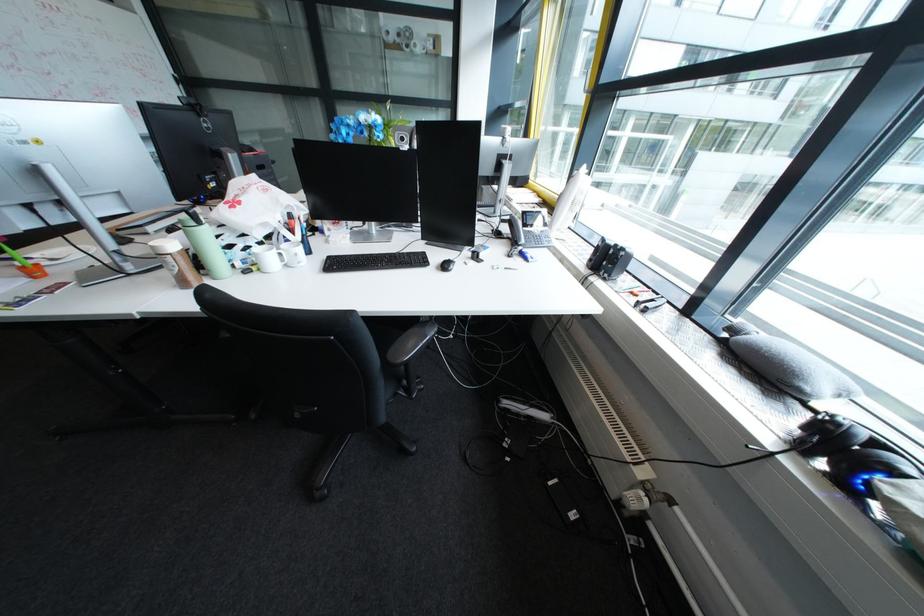
Where would you turn the radiator thermostat? Please return your answer as a coordinate pair (x, y).

(593, 416)